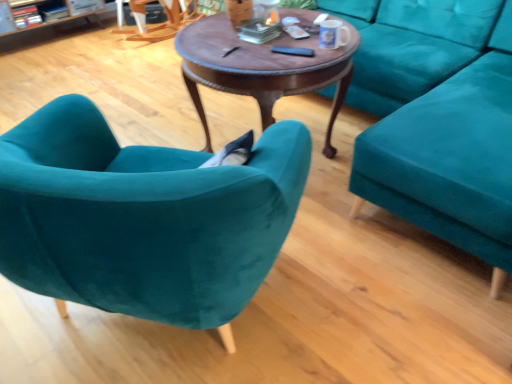
Where is `empty space that is to the right of velvet teal armchair at left`? This screenshot has width=512, height=384. empty space that is to the right of velvet teal armchair at left is located at coordinates (366, 301).